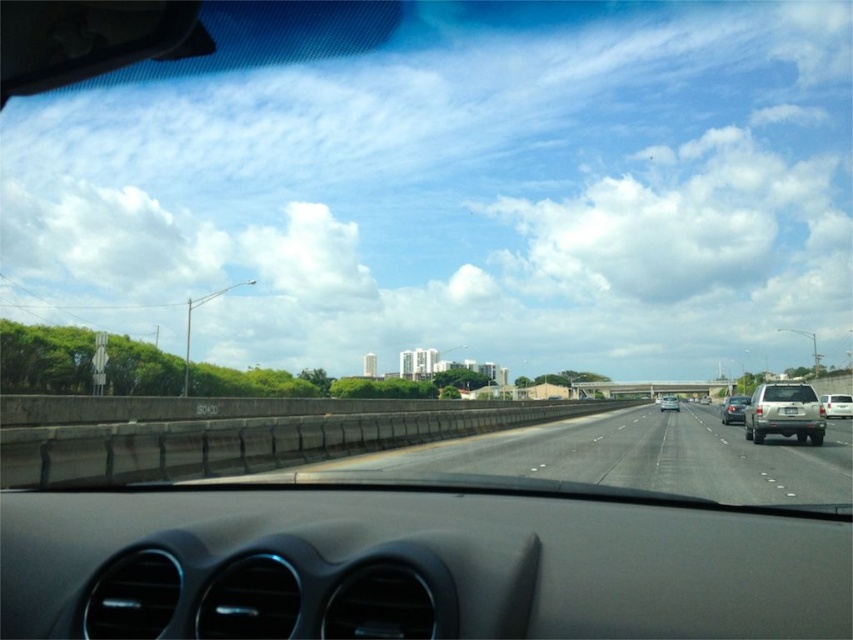
You are a driver looking ahead on the highway. Where is the gray asphalt highway at center located in your view?

The gray asphalt highway at center is located at the coordinates point (635,458) in your view.

You are a passenger in the car and looking out the windshield. You notice two sedans at the center of the road. Which one is taller between the satin silver sedan at center and the silver metallic sedan at center?

The satin silver sedan at center is much taller than the silver metallic sedan at center.